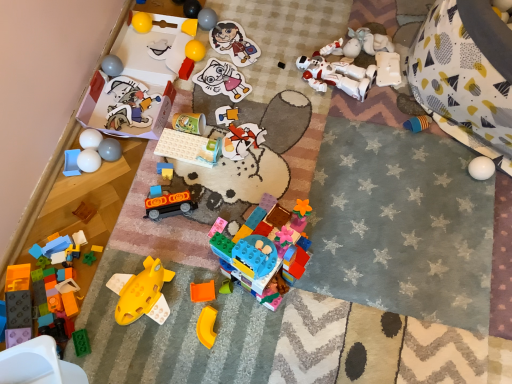
Where is `free space between yellow rubber ball at upper center, which is the 14th toy from left to right, and orange matte toy airplane at center, which is the eighth toy from right to left`? This screenshot has width=512, height=384. free space between yellow rubber ball at upper center, which is the 14th toy from left to right, and orange matte toy airplane at center, which is the eighth toy from right to left is located at coordinates (199, 160).